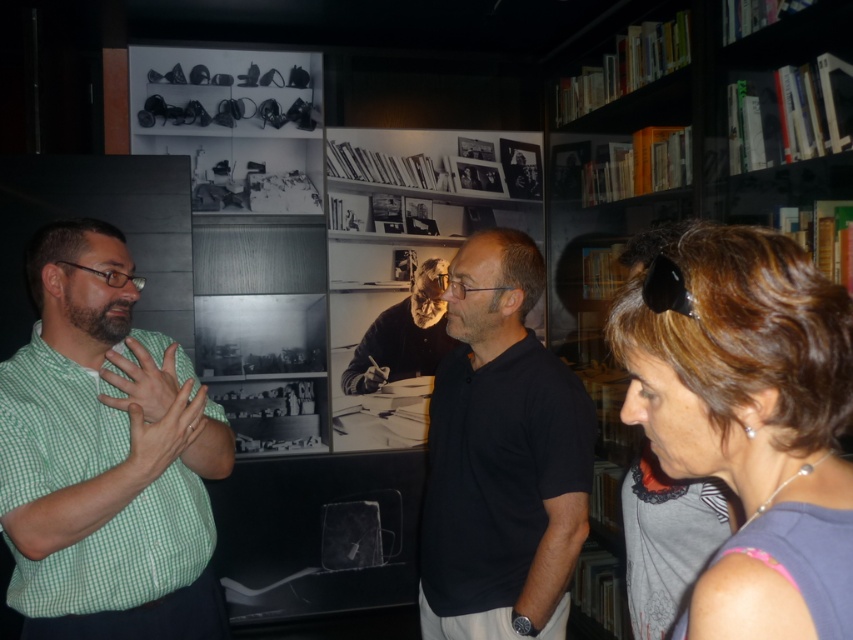
Based on the photo, who is more forward, (x=712, y=397) or (x=531, y=560)?

Positioned in front is point (x=712, y=397).

Locate an element on the screen. gray fabric shirt at right is located at coordinates (749, 420).

Is green checkered shirt at left shorter than black matte shirt at center?

Correct, green checkered shirt at left is not as tall as black matte shirt at center.

Image resolution: width=853 pixels, height=640 pixels. What do you see at coordinates (105, 456) in the screenshot?
I see `green checkered shirt at left` at bounding box center [105, 456].

At what (x,y) coordinates should I click in order to perform the action: click on green checkered shirt at left. Please return your answer as a coordinate pair (x, y). Image resolution: width=853 pixels, height=640 pixels. Looking at the image, I should click on (105, 456).

Which is in front, point (56, 312) or point (756, 563)?

Point (756, 563) is in front.

Does green checkered shirt at left lie behind gray fabric shirt at right?

Yes.

This screenshot has height=640, width=853. Describe the element at coordinates (105, 456) in the screenshot. I see `green checkered shirt at left` at that location.

The image size is (853, 640). I want to click on green checkered shirt at left, so click(105, 456).